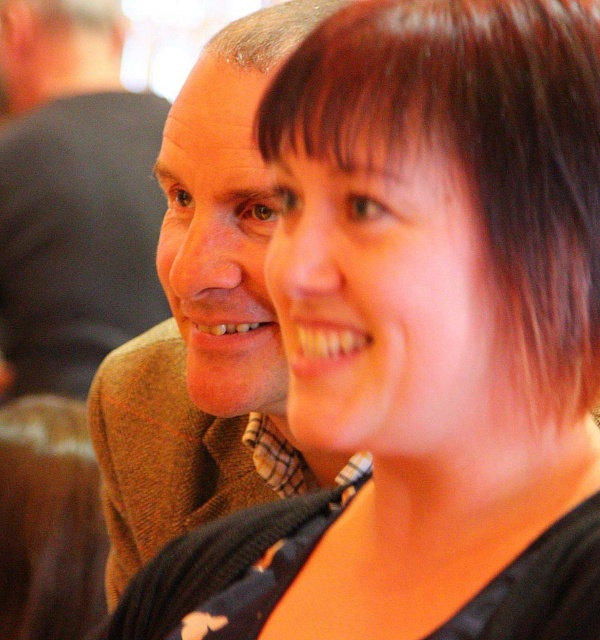
Question: Does brown wool sweater at center come in front of gray matte hair at upper left?

Choices:
 (A) no
 (B) yes

Answer: (B)

Question: Can you confirm if brown wool sweater at center is positioned to the right of brown wool sweater at left?

Choices:
 (A) yes
 (B) no

Answer: (A)

Question: Considering the real-world distances, which object is closest to the gray matte hair at upper left?

Choices:
 (A) brown smooth hair at upper right
 (B) brown wool sweater at center

Answer: (B)

Question: Can you confirm if brown smooth hair at upper right is positioned below brown wool sweater at center?

Choices:
 (A) no
 (B) yes

Answer: (A)

Question: Which point is farther to the camera?

Choices:
 (A) (88, 342)
 (B) (559, 356)

Answer: (A)

Question: Which point appears closest to the camera in this image?

Choices:
 (A) (x=261, y=296)
 (B) (x=495, y=243)
 (C) (x=316, y=6)
 (D) (x=81, y=125)

Answer: (B)